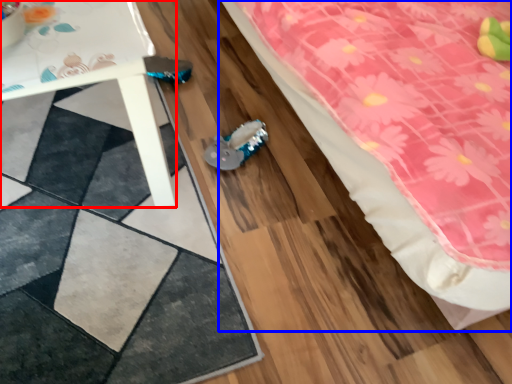
Question: Which object appears closest to the camera in this image, table (highlighted by a red box) or bed (highlighted by a blue box)?

Choices:
 (A) table
 (B) bed

Answer: (B)